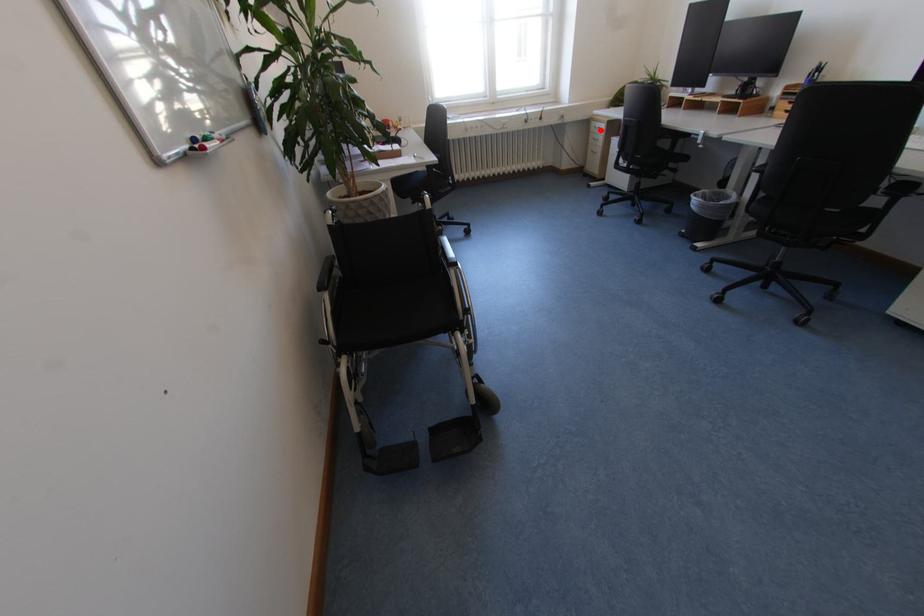
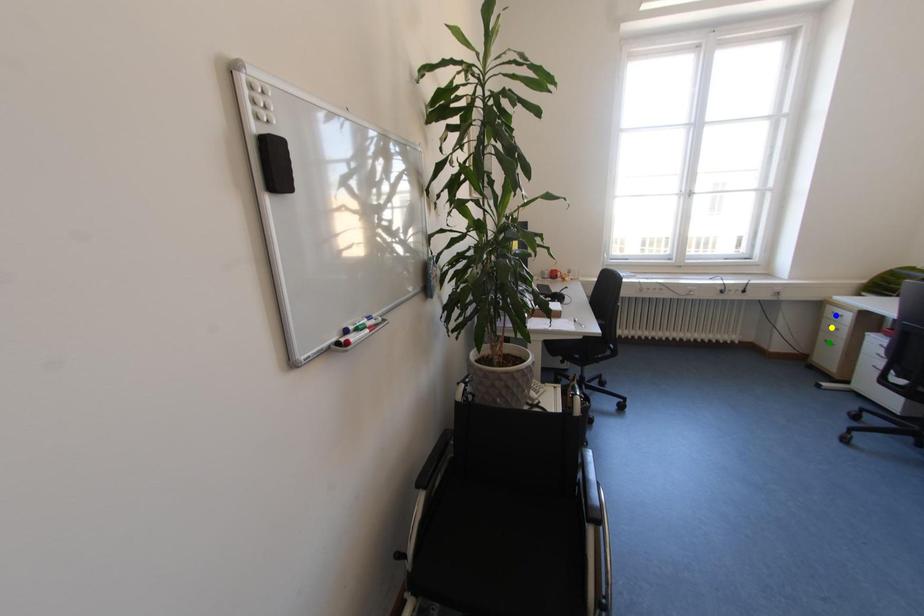
Question: I am providing you with two images of the same scene from different viewpoints. A red point is marked on the first image. You are given multiple points on the second image. Which point in image 2 is actually the same real-world point as the red point in image 1?

Choices:
 (A) blue point
 (B) yellow point
 (C) green point

Answer: (A)